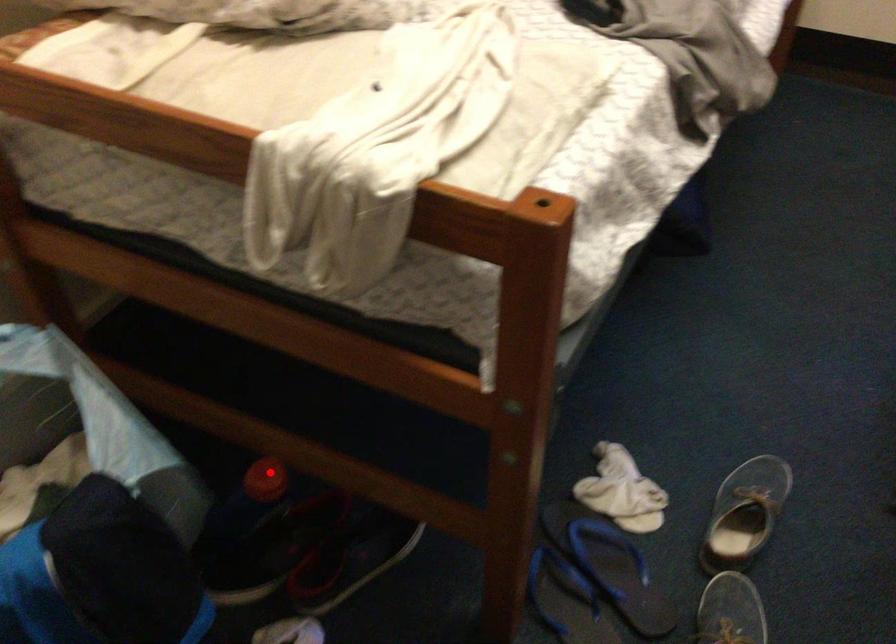
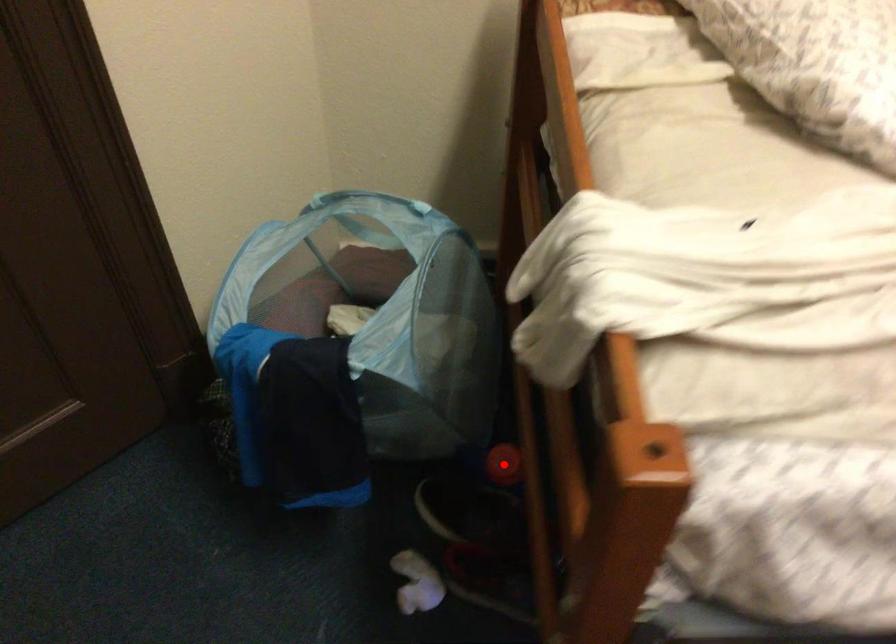
I am providing you with two images of the same scene from different viewpoints. A red point is marked on the first image and another point is marked on the second image. Are the points marked in image1 and image2 representing the same 3D position?

Yes